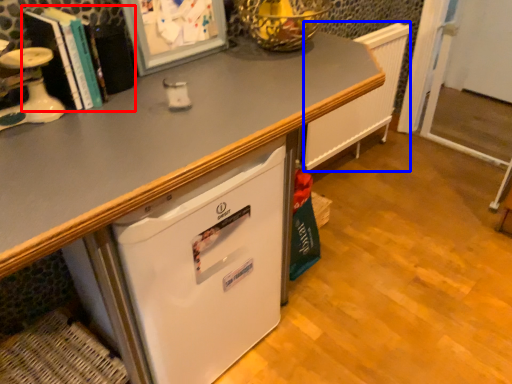
Question: Which object appears closest to the camera in this image, book (highlighted by a red box) or radiator (highlighted by a blue box)?

Choices:
 (A) book
 (B) radiator

Answer: (A)